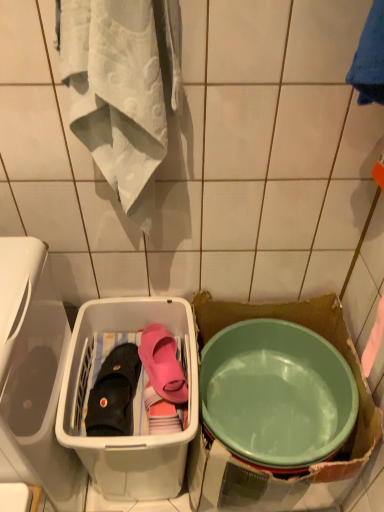
Question: Is point (157, 372) closer or farther from the camera than point (314, 436)?

Choices:
 (A) farther
 (B) closer

Answer: (A)

Question: Considering the positions of pink rubber slipper at center, which appears as the 2th footwear when viewed from the left, and green plastic bowl at lower right in the image, is pink rubber slipper at center, which appears as the 2th footwear when viewed from the left, wider or thinner than green plastic bowl at lower right?

Choices:
 (A) wide
 (B) thin

Answer: (B)

Question: Considering the real-world distances, which object is farthest from the green plastic bowl at lower right?

Choices:
 (A) pink rubber slipper at center, which appears as the 2th footwear when viewed from the left
 (B) black fabric slipper at lower left, positioned as the second footwear in right-to-left order
 (C) translucent plastic basket at center

Answer: (B)

Question: Which is farther from the pink rubber slipper at center, which appears as the 2th footwear when viewed from the left?

Choices:
 (A) black fabric slipper at lower left, the 1th footwear when ordered from left to right
 (B) translucent plastic basket at center
 (C) green plastic bowl at lower right

Answer: (C)